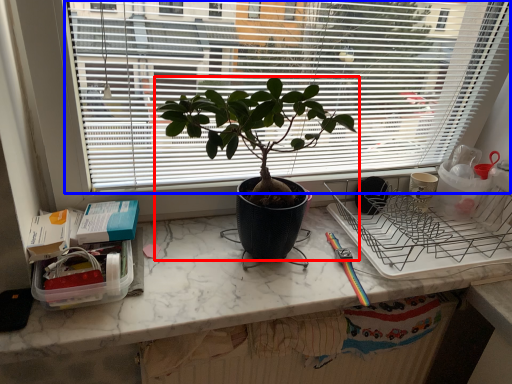
Question: Which point is further to the camera, houseplant (highlighted by a red box) or window (highlighted by a blue box)?

Choices:
 (A) houseplant
 (B) window

Answer: (A)